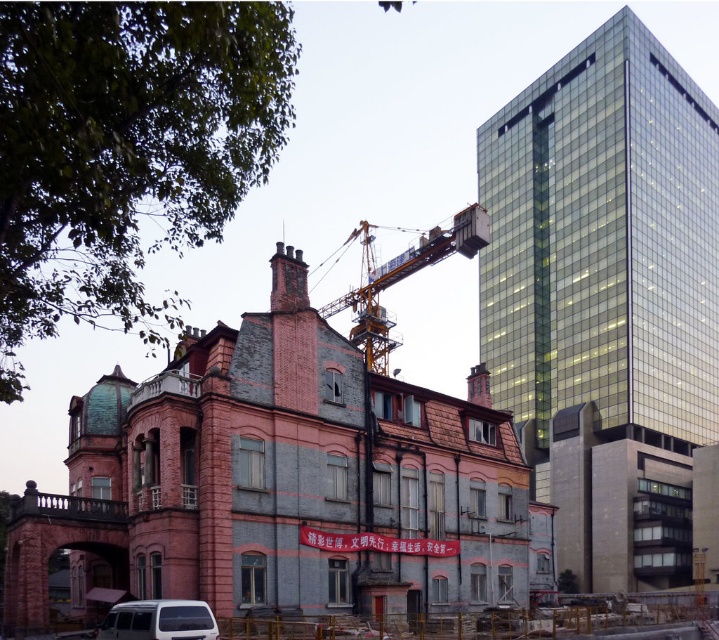
You are a construction worker planning to move a heavy load from the historic building on the left to the modern high rise on the right. The yellow metallic crane at center is positioned at point (400, 278). Can you safely lift the load from the historic building on the left and place it onto the modern high rise on the right using the yellow metallic crane at center?

The yellow metallic crane at center is positioned at point (400, 278), which is centrally located between the historic building on the left and the modern high rise on the right. This central position allows the crane to safely reach both structures, making it feasible to transfer the load between them.

You are standing at the point marked by point (x=278, y=483) in the image. Which building do you see in front of you?

The point marked by point (x=278, y=483) is at the pink brick building at center, so you see the pink brick building at center in front of you.

You are a construction worker who needs to move a heavy equipment from the pink brick building at center to the yellow metallic crane at center. Since both are at the center, which one is closer to you so you can decide the shortest path?

The pink brick building at center is in front of the yellow metallic crane at center, so the pink brick building at center is closer to you.